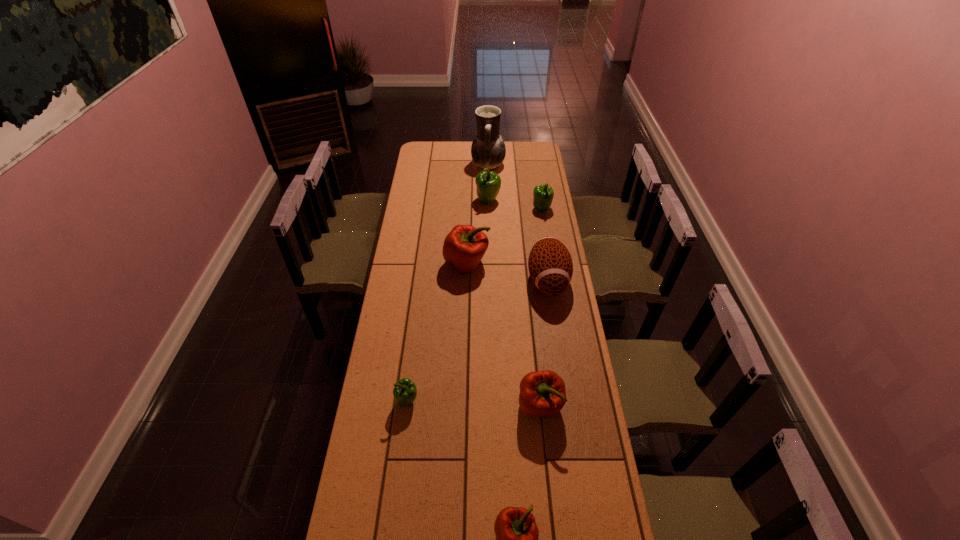
At what (x,y) coordinates should I click in order to perform the action: click on pitcher. Please return your answer as a coordinate pair (x, y). This screenshot has height=540, width=960. Looking at the image, I should click on (488, 150).

This screenshot has width=960, height=540. Identify the location of the tallest object. (488, 150).

The height and width of the screenshot is (540, 960). What are the coordinates of `the biggest green bell pepper` in the screenshot? It's located at (488, 183).

Where is `the fourth nearest bell pepper`? the fourth nearest bell pepper is located at coordinates (464, 247).

Locate an element on the screen. the farthest pink bell pepper is located at coordinates (464, 247).

Where is `football`? The width and height of the screenshot is (960, 540). football is located at coordinates (550, 265).

This screenshot has height=540, width=960. What are the coordinates of `the rightmost green bell pepper` in the screenshot? It's located at (543, 195).

Identify the location of the second nearest pink bell pepper. (542, 393).

The width and height of the screenshot is (960, 540). I want to click on the smallest green bell pepper, so click(x=405, y=392).

Image resolution: width=960 pixels, height=540 pixels. I want to click on the leftmost bell pepper, so click(405, 392).